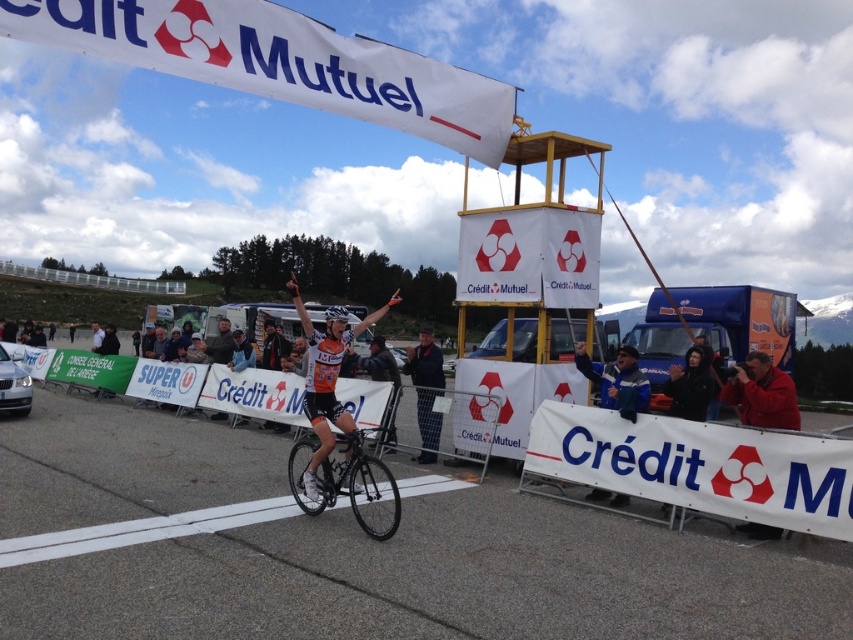
Question: Based on their relative distances, which object is farther from the black leather jacket at upper center?

Choices:
 (A) shiny black bicycle at center
 (B) blue fabric jacket at center
 (C) orange jersey at center
 (D) orange jersey cyclist at center

Answer: (D)

Question: Which object is farther from the camera taking this photo?

Choices:
 (A) shiny black bicycle at center
 (B) orange jersey cyclist at center
 (C) orange jersey at center

Answer: (C)

Question: Among these points, which one is nearest to the camera?

Choices:
 (A) (343, 465)
 (B) (704, 371)
 (C) (332, 374)

Answer: (C)

Question: Is orange jersey at center wider than blue fabric jacket at center?

Choices:
 (A) no
 (B) yes

Answer: (B)

Question: Does orange jersey cyclist at center have a lesser width compared to shiny black bicycle at center?

Choices:
 (A) yes
 (B) no

Answer: (B)

Question: Can you confirm if orange jersey at center is positioned below blue fabric jacket at center?

Choices:
 (A) yes
 (B) no

Answer: (B)